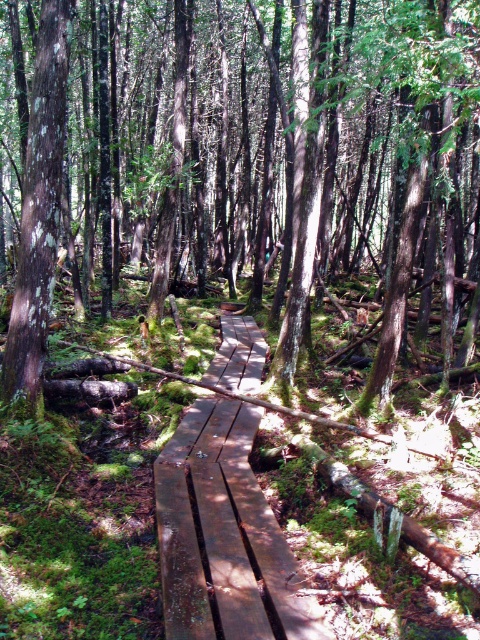
Is the position of smooth brown wooden boardwalk at center more distant than that of smooth brown wooden bridge at center?

No, it is not.

Does point (196, 13) lie in front of point (276, 556)?

No, (196, 13) is further to viewer.

Image resolution: width=480 pixels, height=640 pixels. What do you see at coordinates (279, 150) in the screenshot?
I see `smooth brown wooden boardwalk at center` at bounding box center [279, 150].

This screenshot has width=480, height=640. What are the coordinates of `smooth brown wooden boardwalk at center` in the screenshot? It's located at (279, 150).